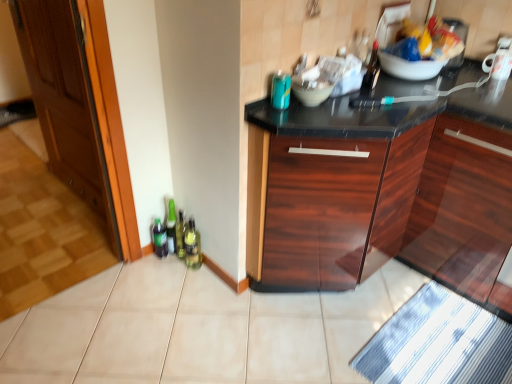
This screenshot has height=384, width=512. I want to click on vacant space to the left of blue striped bath mat at lower right, so click(324, 334).